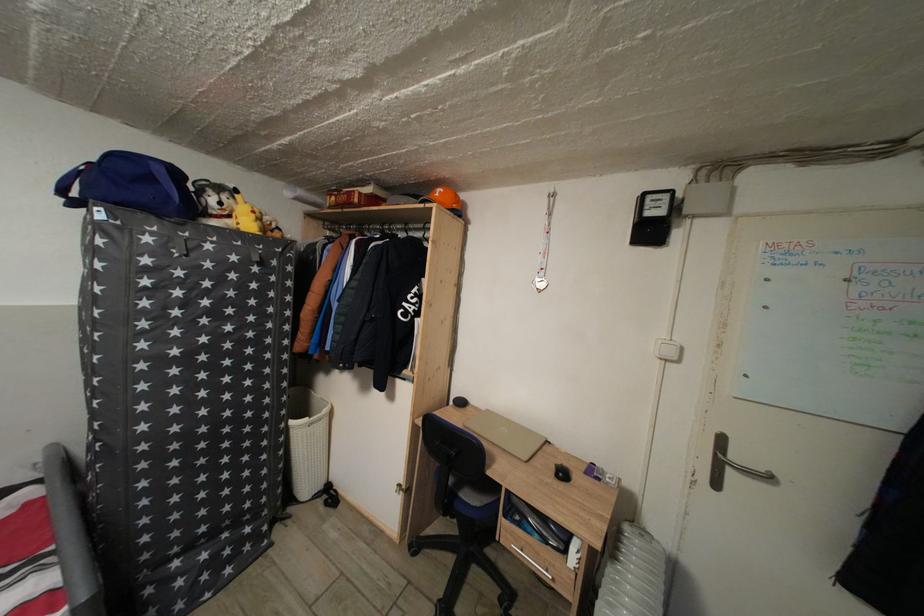
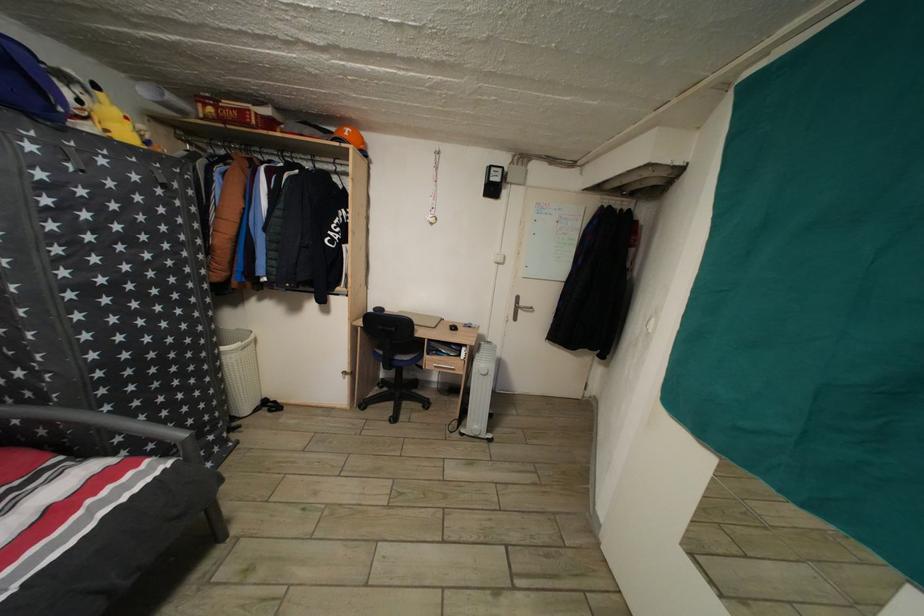
Find the pixel in the second image that matches the point at 672,342 in the first image.

(505, 257)